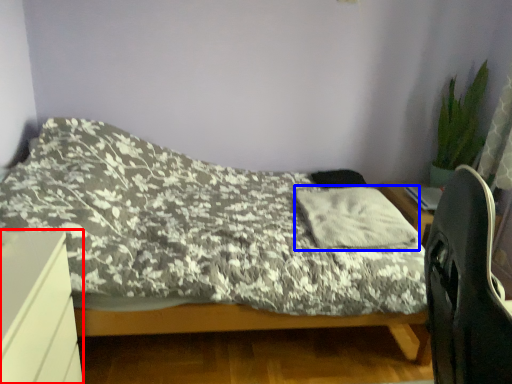
Question: Which of the following is the farthest to the observer, desk (highlighted by a red box) or pillow (highlighted by a blue box)?

Choices:
 (A) desk
 (B) pillow

Answer: (B)